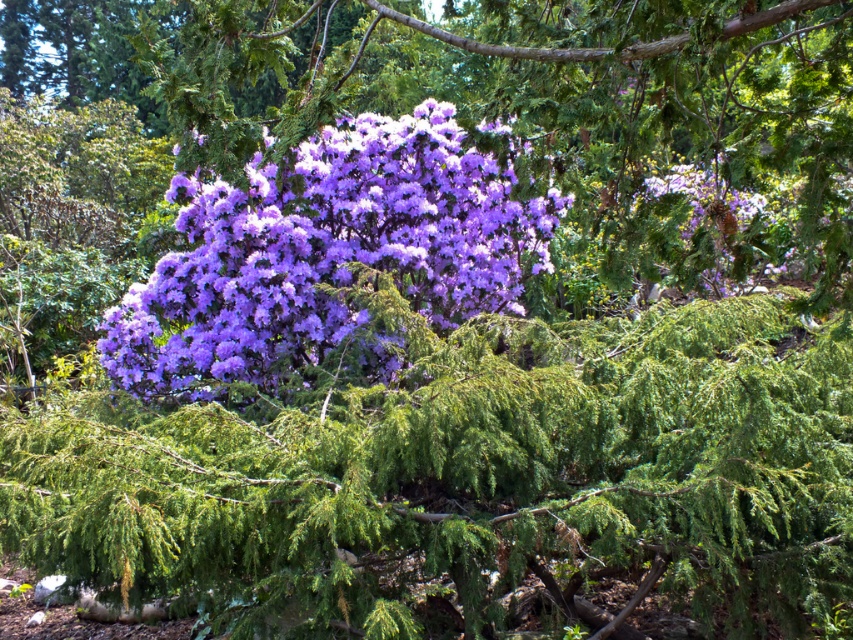
Question: Does purple matte bush at center have a lesser width compared to purple matte flower at center?

Choices:
 (A) no
 (B) yes

Answer: (A)

Question: Is purple matte bush at center to the right of purple matte flower at center from the viewer's perspective?

Choices:
 (A) no
 (B) yes

Answer: (B)

Question: Which object is farther from the camera taking this photo?

Choices:
 (A) purple matte flower at center
 (B) purple matte bush at center

Answer: (A)

Question: Among these points, which one is farthest from the camera?

Choices:
 (A) (689, 259)
 (B) (271, 362)

Answer: (B)

Question: Considering the relative positions of purple matte bush at center and purple matte flower at center in the image provided, where is purple matte bush at center located with respect to purple matte flower at center?

Choices:
 (A) left
 (B) right

Answer: (B)